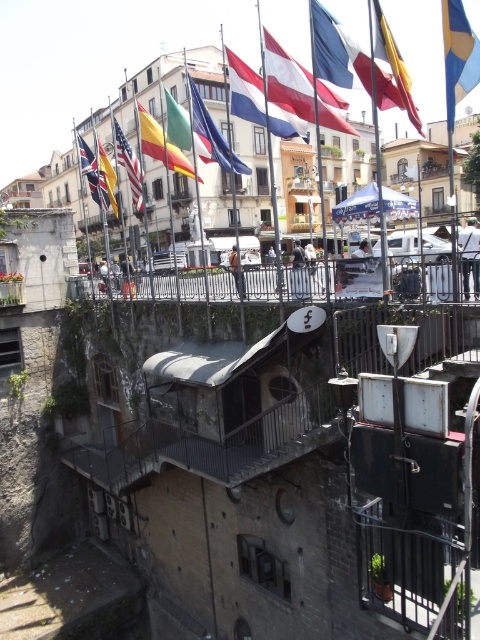
You are standing at the elevated position looking down at the street. There is a point marked at coordinates point (x=445, y=10). If you want to throw a small object to that point, will it land within 20 meters from you?

The distance of point (x=445, y=10) from viewer is 18.40 meters, so yes, the object will land within 20 meters from you since 18.40 meters is less than 20 meters.

You are standing on the stone building with a weathered facade and looking down at the street below. You notice a point marked at coordinates (97, 173). What object is located at this point?

The point at coordinates (97, 173) corresponds to the union jack fabric flag at upper left.

Consider the image. You are a photographer trying to capture a shot of the union jack fabric flag at upper left and the matte black flag at upper center. Which flag should you focus on if you want to photograph the taller one?

The matte black flag at upper center is taller than the union jack fabric flag at upper left, so you should focus on the matte black flag at upper center to photograph the taller one.